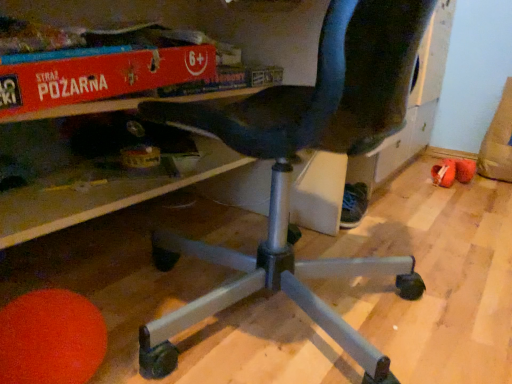
Question: In the image, is red cardboard box at upper center positioned in front of or behind orange fabric shoe at lower right, marked as the second footwear in a front-to-back arrangement?

Choices:
 (A) behind
 (B) front

Answer: (B)

Question: Do you think red cardboard box at upper center is within orange fabric shoe at lower right, marked as the 1th footwear in a right-to-left arrangement, or outside of it?

Choices:
 (A) inside
 (B) outside

Answer: (B)

Question: Considering the real-world distances, which object is farthest from the red cardboard box at upper center?

Choices:
 (A) brown suede bean bag at lower right
 (B) black fabric shoe at lower center, the second footwear from the back
 (C) orange fabric shoe at lower right, marked as the 1th footwear in a right-to-left arrangement
 (D) black plastic chair at center

Answer: (A)

Question: Which object is the farthest from the black fabric shoe at lower center, which ranks as the first footwear in front-to-back order?

Choices:
 (A) brown suede bean bag at lower right
 (B) red cardboard box at upper center
 (C) orange fabric shoe at lower right, marked as the second footwear in a front-to-back arrangement
 (D) black plastic chair at center

Answer: (A)